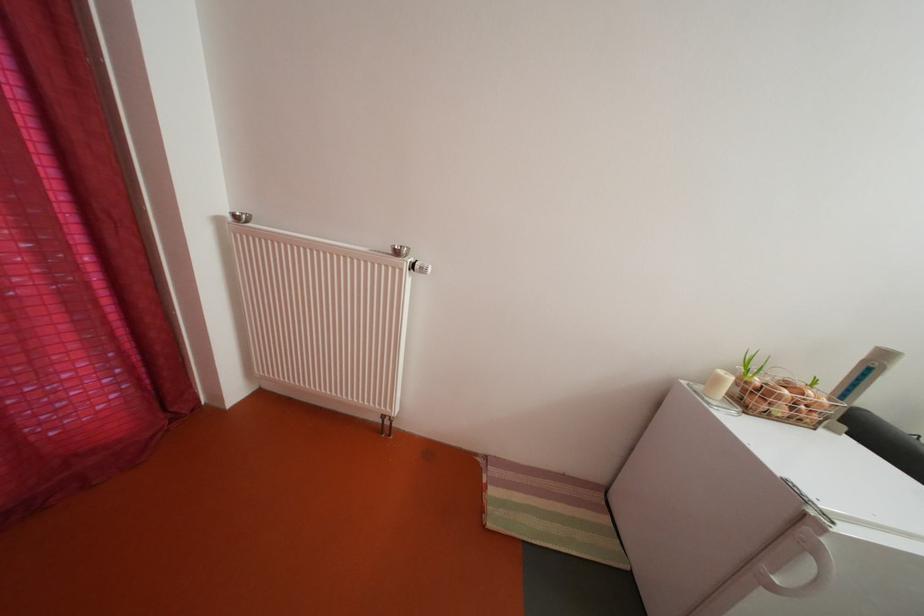
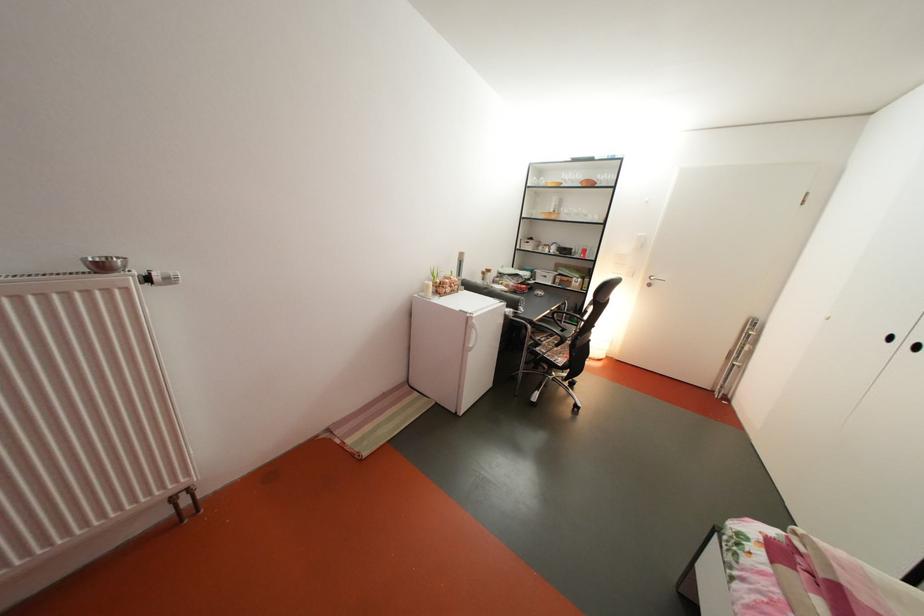
Question: I am providing you with two images of the same scene from different viewpoints. Please identify which objects are invisible in image2.

Choices:
 (A) silver door handle
 (B) small clear glass
 (C) small silver bowl
 (D) none of these

Answer: (D)